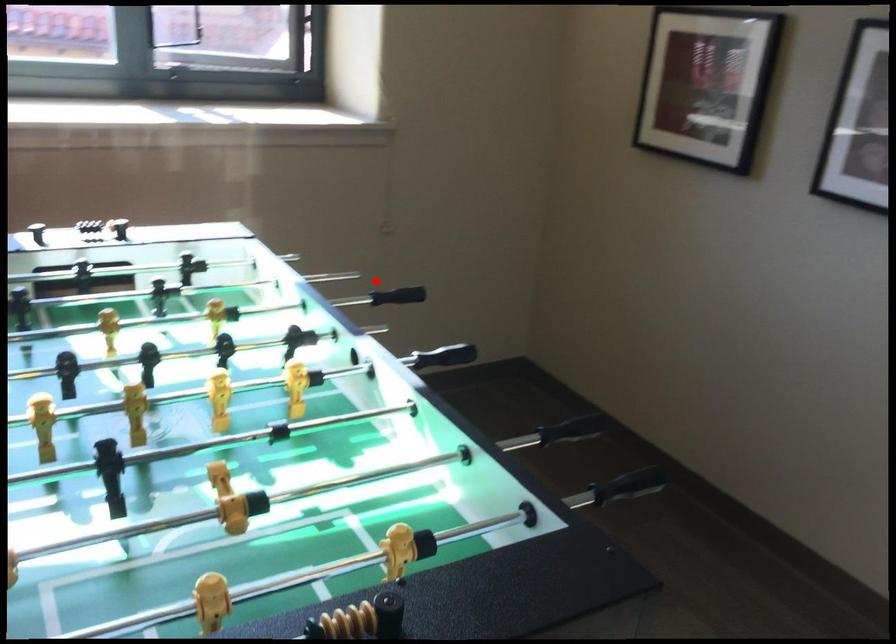
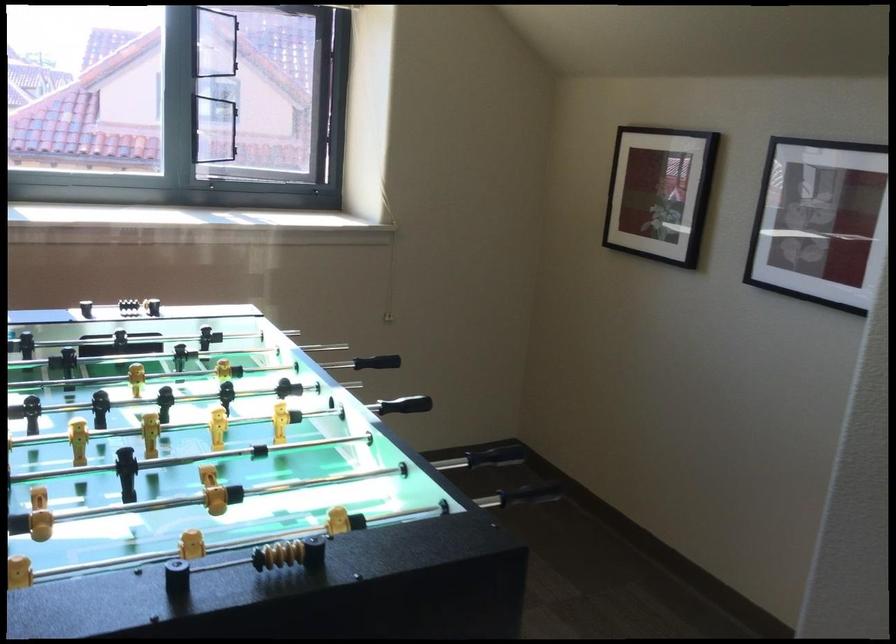
Locate, in the second image, the point that corresponds to the highlighted location in the first image.

(376, 362)